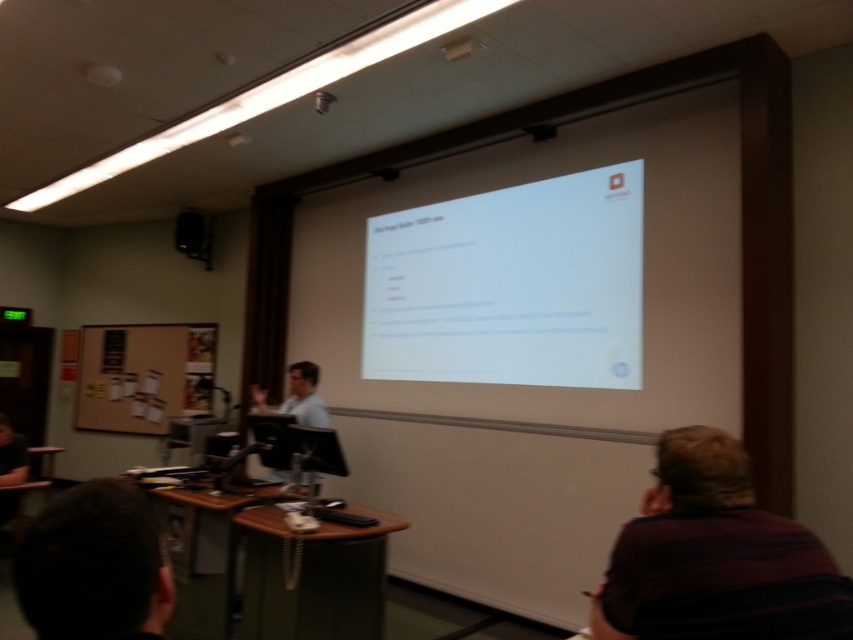
Question: Which point appears closest to the camera in this image?

Choices:
 (A) (474, 330)
 (B) (318, 396)
 (C) (831, 602)

Answer: (C)

Question: Can you confirm if white matte projector screen at center is thinner than striped sweater at lower right?

Choices:
 (A) yes
 (B) no

Answer: (B)

Question: Considering the real-world distances, which object is closest to the white shirt at center?

Choices:
 (A) striped sweater at lower right
 (B) white matte projector screen at center

Answer: (B)

Question: Observing the image, what is the correct spatial positioning of white matte projector screen at center in reference to white shirt at center?

Choices:
 (A) left
 (B) right

Answer: (B)

Question: Which of the following is the farthest from the observer?

Choices:
 (A) striped sweater at lower right
 (B) white shirt at center
 (C) white matte projector screen at center

Answer: (B)

Question: Does white matte projector screen at center appear on the right side of striped sweater at lower right?

Choices:
 (A) no
 (B) yes

Answer: (A)